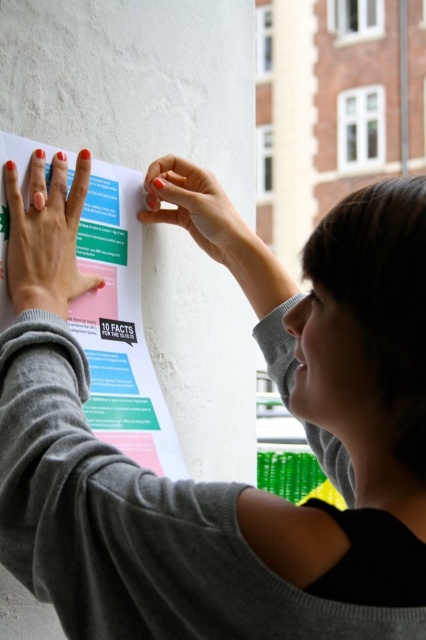
Question: Does white paper poster at upper left appear under nail polish coated finger at upper center?

Choices:
 (A) yes
 (B) no

Answer: (A)

Question: Is white paper poster at upper left thinner than nail polish coated finger at upper center?

Choices:
 (A) yes
 (B) no

Answer: (B)

Question: Which point appears closest to the camera in this image?

Choices:
 (A) (235, 259)
 (B) (134, 188)
 (C) (48, 285)

Answer: (C)

Question: Which object is positioned closest to the nail polish coated finger at upper center?

Choices:
 (A) white paper poster at upper left
 (B) matte pink nail polish at upper left

Answer: (A)

Question: Is matte pink nail polish at upper left above nail polish coated finger at upper center?

Choices:
 (A) no
 (B) yes

Answer: (A)

Question: Which object is closer to the camera taking this photo?

Choices:
 (A) nail polish coated finger at upper center
 (B) white paper poster at upper left

Answer: (B)